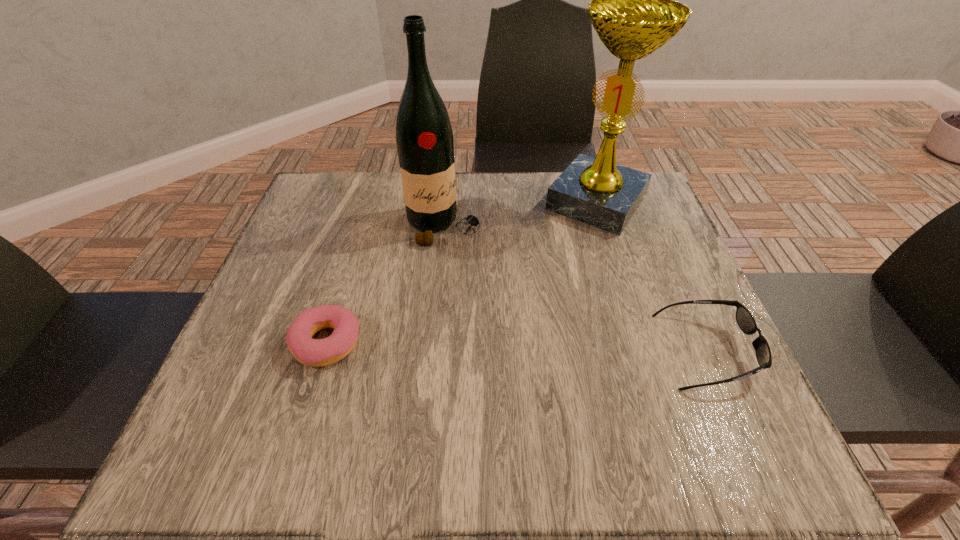
The height and width of the screenshot is (540, 960). Find the location of `vacant area between the award and the doughnut`. vacant area between the award and the doughnut is located at coordinates (462, 273).

Find the location of a particular element. This screenshot has height=540, width=960. vacant space that's between the sunglasses and the award is located at coordinates [x=651, y=276].

Locate an element on the screen. This screenshot has width=960, height=540. free space that is in between the award and the shortest object is located at coordinates (462, 273).

The width and height of the screenshot is (960, 540). In order to click on free spot between the leftmost object and the award in this screenshot , I will do `click(462, 273)`.

Find the location of a particular element. The width and height of the screenshot is (960, 540). free space between the sunglasses and the award is located at coordinates (651, 276).

Where is `empty space that is in between the second shortest object and the award`? The image size is (960, 540). empty space that is in between the second shortest object and the award is located at coordinates (651, 276).

Identify the location of free area in between the sunglasses and the second object from left to right. (574, 288).

What are the coordinates of `vacant space in between the doughnut and the third tallest object` in the screenshot? It's located at (516, 347).

Identify which object is the nearest to the sunglasses. Please provide its 2D coordinates. Your answer should be formatted as a tuple, i.e. [(x, y)], where the tuple contains the x and y coordinates of a point satisfying the conditions above.

[(634, 11)]

Locate an element on the screen. The image size is (960, 540). object that is the nearest to the third tallest object is located at coordinates (634, 11).